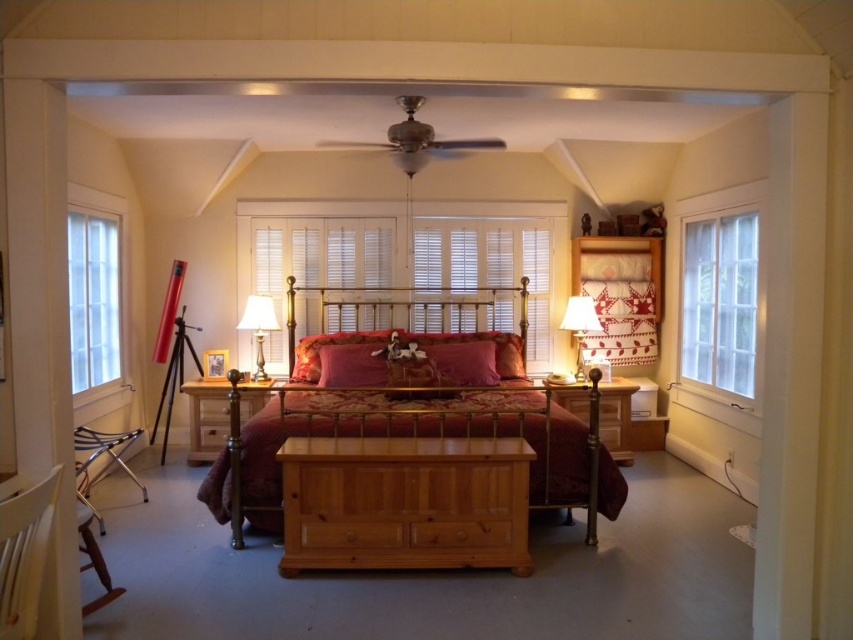
Which is behind, point (743, 221) or point (265, 308)?

Point (265, 308)

Does clear glass window at right have a greater width compared to matte gold lamp at left?

Incorrect, clear glass window at right's width does not surpass matte gold lamp at left's.

Is point (718, 358) positioned behind point (260, 360)?

No, it is not.

Locate an element on the screen. clear glass window at right is located at coordinates (720, 300).

Is velvet red pillow at center thinner than white fabric lampshade at right?

Incorrect, velvet red pillow at center's width is not less than white fabric lampshade at right's.

Does velvet red pillow at center lie in front of white fabric lampshade at right?

That is True.

Which is behind, point (363, 349) or point (567, 304)?

The point (567, 304) is more distant.

Identify the location of velvet red pillow at center. (351, 365).

Does polished brass bed at center appear on the right side of metallic gold headboard at center?

In fact, polished brass bed at center is to the left of metallic gold headboard at center.

Who is positioned more to the left, polished brass bed at center or metallic gold headboard at center?

polished brass bed at center is more to the left.

Which is in front, point (608, 493) or point (502, 328)?

Point (608, 493) is in front.

What are the coordinates of `polished brass bed at center` in the screenshot? It's located at (415, 429).